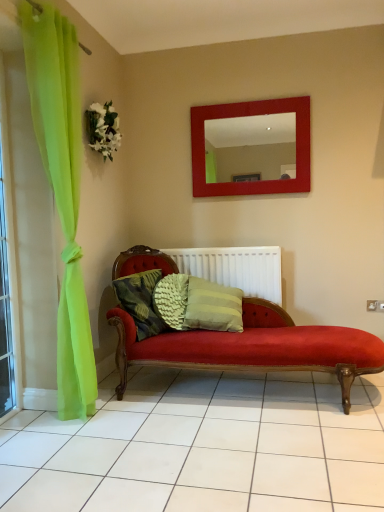
Question: Are white fabric flower at upper left and white plastic radiator at center located far from each other?

Choices:
 (A) no
 (B) yes

Answer: (B)

Question: From the image's perspective, would you say white fabric flower at upper left is shown under white plastic radiator at center?

Choices:
 (A) yes
 (B) no

Answer: (B)

Question: Is white fabric flower at upper left aimed at white plastic radiator at center?

Choices:
 (A) yes
 (B) no

Answer: (B)

Question: Does white fabric flower at upper left have a smaller size compared to white plastic radiator at center?

Choices:
 (A) no
 (B) yes

Answer: (B)

Question: Is white fabric flower at upper left taller than white plastic radiator at center?

Choices:
 (A) no
 (B) yes

Answer: (A)

Question: Considering the relative sizes of white fabric flower at upper left and white plastic radiator at center in the image provided, is white fabric flower at upper left bigger than white plastic radiator at center?

Choices:
 (A) no
 (B) yes

Answer: (A)

Question: Is clear glass window at left not near red glossy mirror at upper center?

Choices:
 (A) no
 (B) yes

Answer: (B)

Question: Is clear glass window at left bigger than red glossy mirror at upper center?

Choices:
 (A) yes
 (B) no

Answer: (B)

Question: Can you confirm if clear glass window at left is smaller than red glossy mirror at upper center?

Choices:
 (A) yes
 (B) no

Answer: (A)

Question: Is clear glass window at left in front of red glossy mirror at upper center?

Choices:
 (A) yes
 (B) no

Answer: (A)

Question: Does clear glass window at left have a greater width compared to red glossy mirror at upper center?

Choices:
 (A) no
 (B) yes

Answer: (A)

Question: Is clear glass window at left oriented away from red glossy mirror at upper center?

Choices:
 (A) yes
 (B) no

Answer: (B)

Question: Is white fabric flower at upper left positioned in front of clear glass window at left?

Choices:
 (A) no
 (B) yes

Answer: (A)